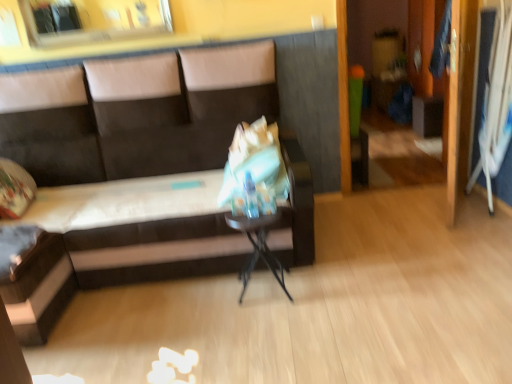
Question: Considering their positions, is metallic silver table at center located in front of or behind dark brown leather couch at center?

Choices:
 (A) behind
 (B) front

Answer: (A)

Question: Looking at the image, does metallic silver table at center seem bigger or smaller compared to dark brown leather couch at center?

Choices:
 (A) big
 (B) small

Answer: (B)

Question: Based on their positions, is metallic silver table at center located to the left or right of dark brown leather couch at center?

Choices:
 (A) right
 (B) left

Answer: (A)

Question: In terms of height, does dark brown leather couch at center look taller or shorter compared to metallic silver table at center?

Choices:
 (A) tall
 (B) short

Answer: (A)

Question: Is dark brown leather couch at center in front of or behind metallic silver table at center in the image?

Choices:
 (A) front
 (B) behind

Answer: (A)

Question: From the image's perspective, relative to metallic silver table at center, is dark brown leather couch at center above or below?

Choices:
 (A) below
 (B) above

Answer: (B)

Question: In terms of width, does dark brown leather couch at center look wider or thinner when compared to metallic silver table at center?

Choices:
 (A) thin
 (B) wide

Answer: (B)